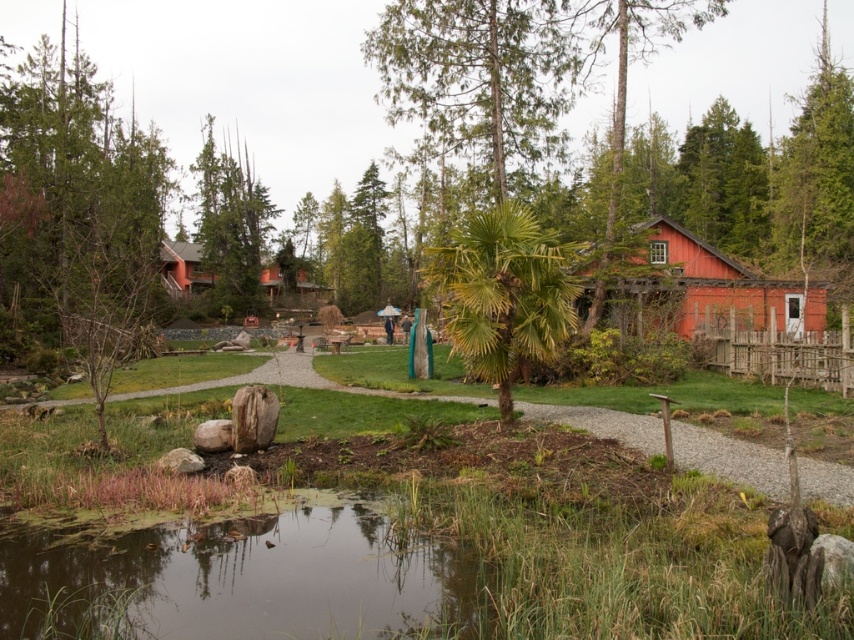
You are standing at the start of the gravel path on the left. You want to walk towards the center of the scene. Which object will you pass first, the green leafy palm tree at center or the green textured tree at upper left?

You will pass the green textured tree at upper left first because the green leafy palm tree at center is to the right of it, meaning the green textured tree at upper left is closer to your starting position on the left side of the path.

You are planning to build a small garden between the green grassy pond at lower center and the red wooden hut at center. Based on their positions, which object should you place the garden closer to in order to be between them?

The garden should be placed closer to the red wooden hut at center since the green grassy pond at lower center is on the left side of the red wooden hut at center, making the hut the rightmost point between them.

You are planning to place a new bench along the gravel pathway between the green leafy palm tree at center and the red wooden hut at center. Considering their sizes, which object would allow more space for the bench on either side?

The green leafy palm tree at center is thinner than the red wooden hut at center, so placing the bench near the green leafy palm tree at center would provide more space on either side.